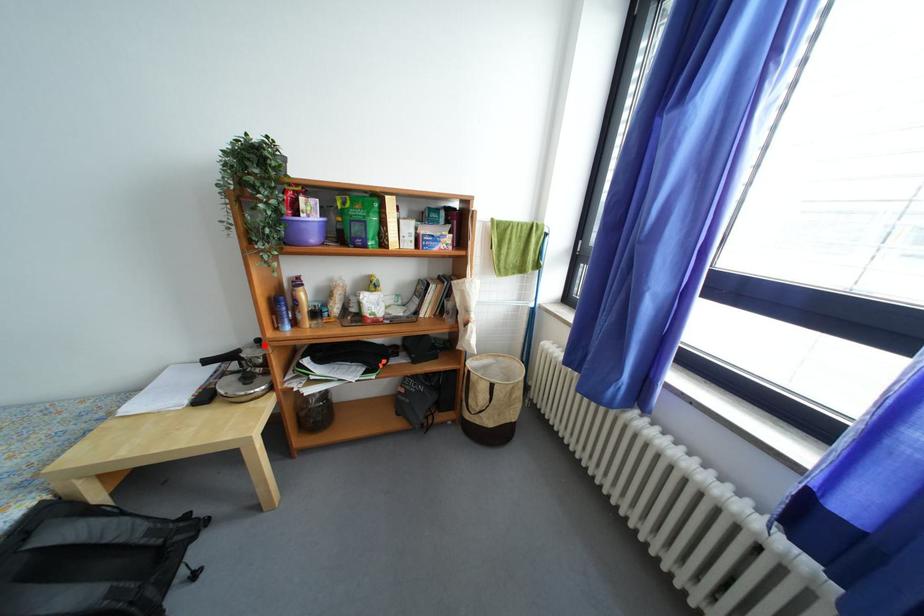
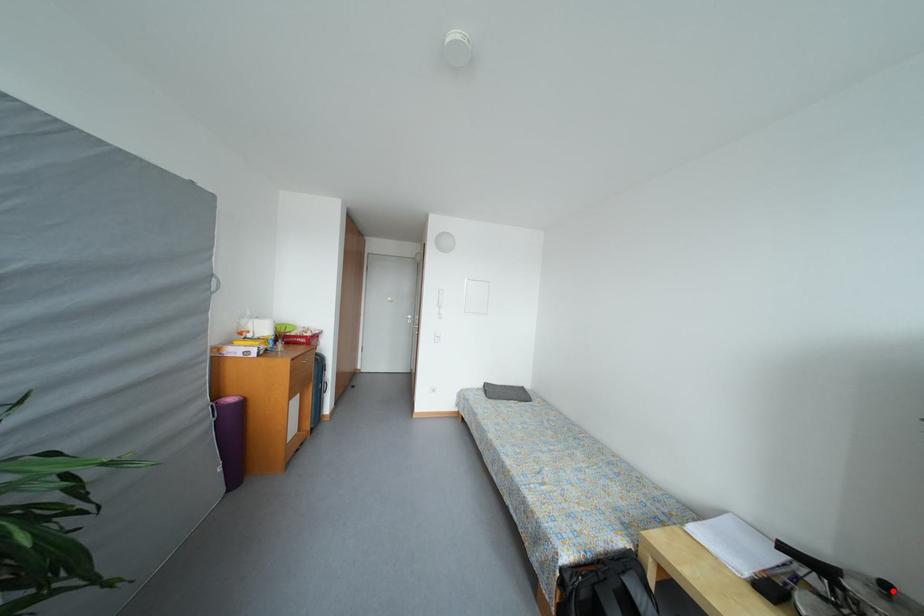
I am providing you with two images of the same scene from different viewpoints. A red point is marked on the first image and another point is marked on the second image. Is the red point in image1 aligned with the point shown in image2?

Yes